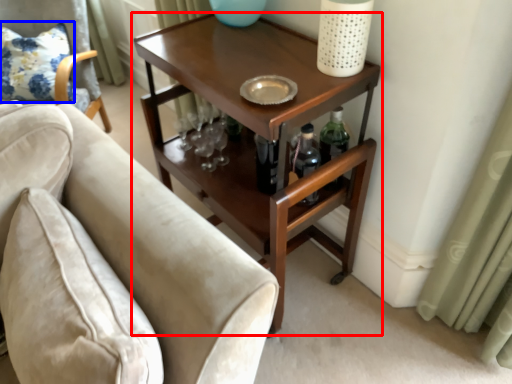
Question: Which object is closer to the camera taking this photo, table (highlighted by a red box) or pillow (highlighted by a blue box)?

Choices:
 (A) table
 (B) pillow

Answer: (A)